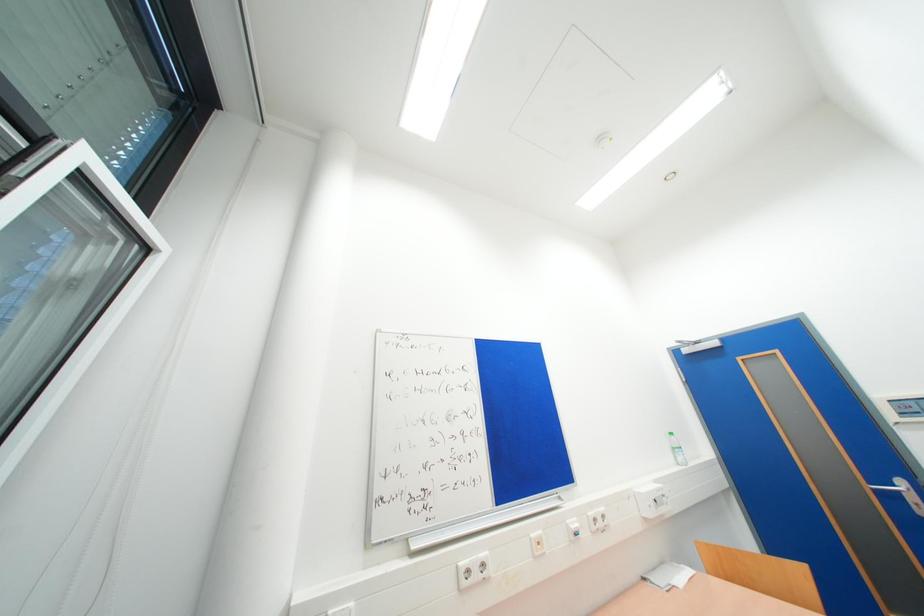
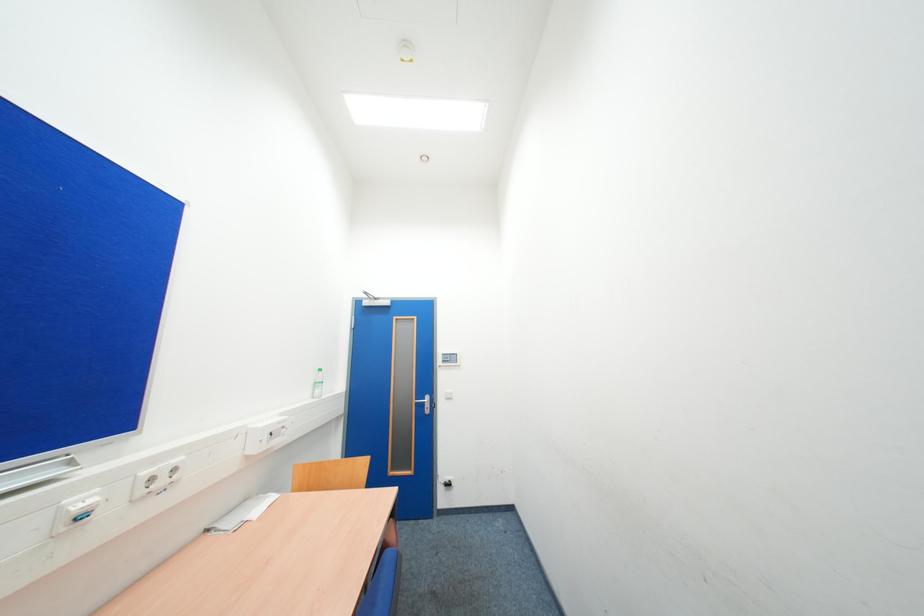
Question: The camera is either moving clockwise (left) or counter-clockwise (right) around the object. The first image is from the beginning of the video and the second image is from the end. Is the camera moving left or right when shooting the video?

Choices:
 (A) Left
 (B) Right

Answer: (A)